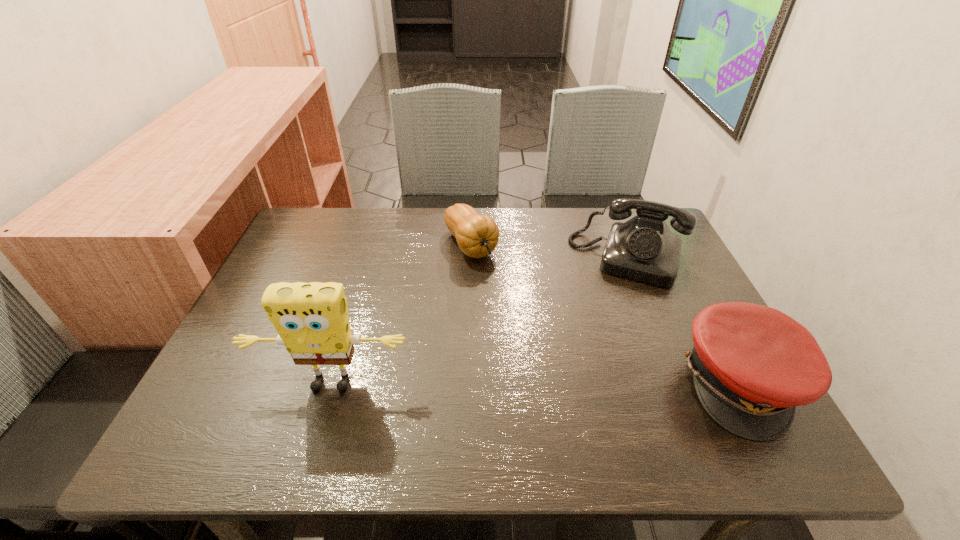
The height and width of the screenshot is (540, 960). In order to click on the leftmost object in this screenshot , I will do `click(312, 320)`.

The height and width of the screenshot is (540, 960). Identify the location of sponge. (312, 320).

What are the coordinates of `cap` in the screenshot? It's located at (752, 365).

Find the location of `gourd`. gourd is located at coordinates (477, 235).

At what (x,y) coordinates should I click in order to perform the action: click on telephone. Please return your answer as a coordinate pair (x, y). Looking at the image, I should click on (643, 249).

Locate an element on the screen. This screenshot has width=960, height=540. free space located 0.050m on the stem side of the gourd is located at coordinates (492, 278).

Identify the location of vacant region located 0.230m on the stem side of the gourd. (527, 323).

Identify the location of vacant space located on the stem side of the gourd. (548, 349).

This screenshot has height=540, width=960. I want to click on vacant space located 0.280m on the dial of the telephone, so click(594, 367).

At what (x,y) coordinates should I click in order to perform the action: click on vacant space located 0.110m on the dial of the telephone. Please return your answer as a coordinate pair (x, y). The height and width of the screenshot is (540, 960). Looking at the image, I should click on (609, 314).